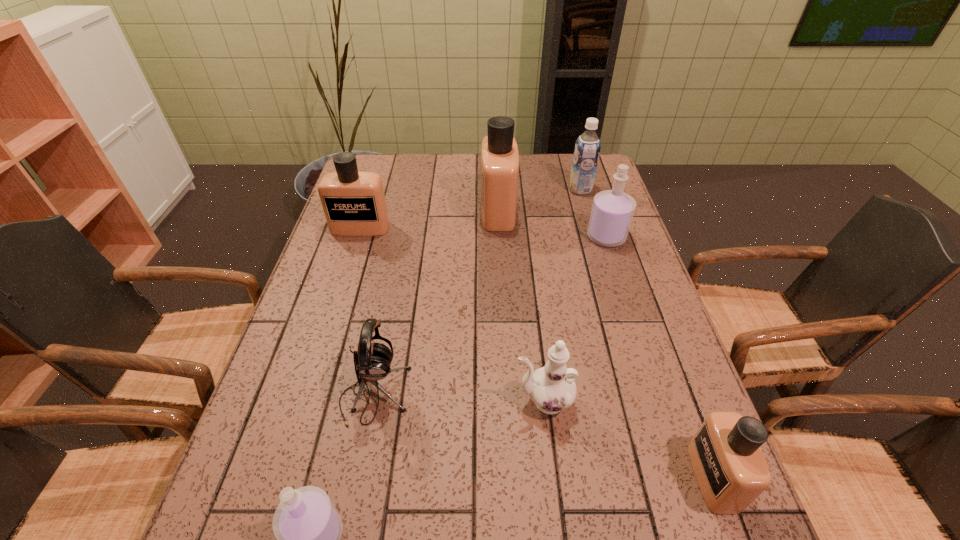
At what (x,y) coordinates should I click in order to perform the action: click on the tallest perfume. Please return your answer as a coordinate pair (x, y). Looking at the image, I should click on pyautogui.click(x=499, y=152).

At what (x,y) coordinates should I click in order to perform the action: click on the third perfume from left to right. Please return your answer as a coordinate pair (x, y). This screenshot has width=960, height=540. Looking at the image, I should click on (499, 152).

The image size is (960, 540). Find the location of `soya milk`. soya milk is located at coordinates (587, 148).

The width and height of the screenshot is (960, 540). Identify the location of the right purple perfume. (612, 211).

Locate an element on the screen. This screenshot has height=540, width=960. the farther purple perfume is located at coordinates (612, 211).

At what (x,y) coordinates should I click in order to perform the action: click on the leftmost beige perfume. Please return your answer as a coordinate pair (x, y). The height and width of the screenshot is (540, 960). Looking at the image, I should click on (354, 204).

The image size is (960, 540). In order to click on chinaware in this screenshot , I will do `click(552, 388)`.

I want to click on earphone, so click(372, 361).

The image size is (960, 540). I want to click on the smallest beige perfume, so click(730, 468).

In order to click on the nearest beige perfume in this screenshot , I will do `click(730, 468)`.